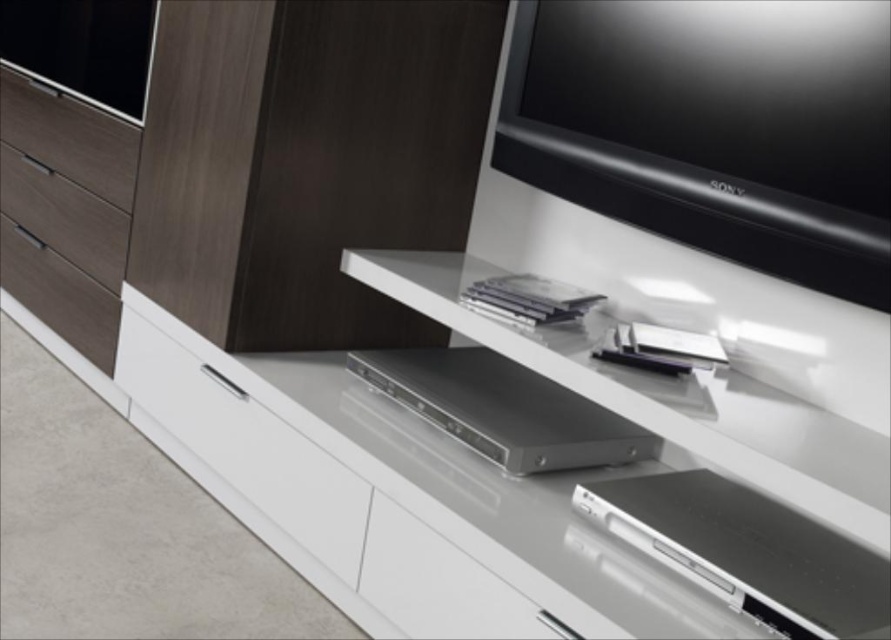
Question: Is the position of matte wood drawer at upper left more distant than that of matte wood drawer at left?

Choices:
 (A) yes
 (B) no

Answer: (B)

Question: Which point is farther from the camera taking this photo?

Choices:
 (A) (113, 193)
 (B) (194, 442)

Answer: (A)

Question: Can you confirm if white glossy drawer at lower left is positioned to the left of matte wood drawer at upper left?

Choices:
 (A) no
 (B) yes

Answer: (A)

Question: Which object appears closest to the camera in this image?

Choices:
 (A) matte wood drawer at upper left
 (B) white glossy drawer at lower left
 (C) black glossy tv at upper right
 (D) matte wood drawer at left

Answer: (C)

Question: Can you confirm if white glossy drawer at lower left is positioned below matte wood drawer at upper left?

Choices:
 (A) yes
 (B) no

Answer: (A)

Question: Which of the following is the farthest from the observer?

Choices:
 (A) white glossy drawer at lower left
 (B) black glossy tv at upper right
 (C) matte wood drawer at upper left
 (D) matte wood drawer at left

Answer: (D)